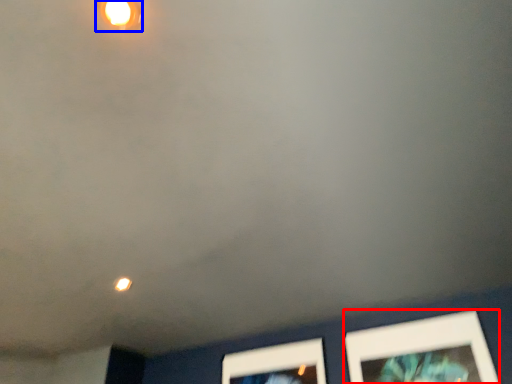
Question: Which object is further to the camera taking this photo, picture frame (highlighted by a red box) or light fixture (highlighted by a blue box)?

Choices:
 (A) picture frame
 (B) light fixture

Answer: (A)